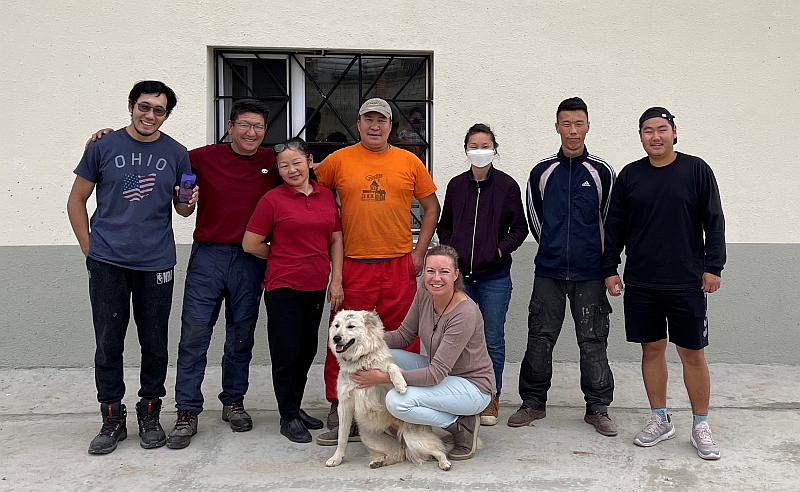
You are a GUI agent. You are given a task and a screenshot of the screen. Output one action in this format:
    pyautogui.click(x=<x>, y=<y>)
    Task: Click on the window
    This screenshot has width=800, height=492.
    Given the screenshot: What is the action you would take?
    pyautogui.click(x=344, y=100), pyautogui.click(x=281, y=127)